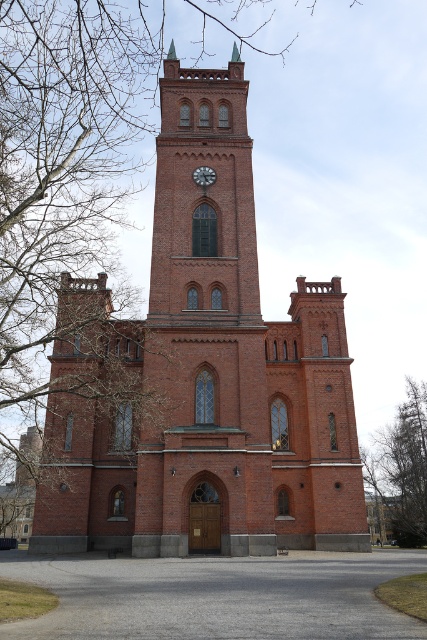
You are standing in front of the church and want to take a photo of both the red brick clock tower at center and the white painted metal clock at upper center. Which object should you adjust your camera to focus on first if you want to capture both in the same frame?

The red brick clock tower at center is positioned on the right side of white painted metal clock at upper center. To capture both in the same frame, focus on the white painted metal clock at upper center first as it is centrally located and the tower is to its right, ensuring both are within the camera view.

You are an architect visiting the church and want to estimate the relative sizes of the red brick clock tower at center and the white painted metal clock at upper center. Based on the scene, which of the two objects is bigger?

The red brick clock tower at center is larger in size than the white painted metal clock at upper center according to the description.

In the scene shown: You are standing at the entrance of a park and see the red brick church at center in the distance. If you want to take a photo of the church with your smartphone, which has a maximum zoom range of 100 feet, will you be able to capture the entire church without moving closer?

The red brick church at center is 179.25 feet away from you. Since your smartphone has a maximum zoom range of 100 feet, you will not be able to capture the entire church without moving closer.